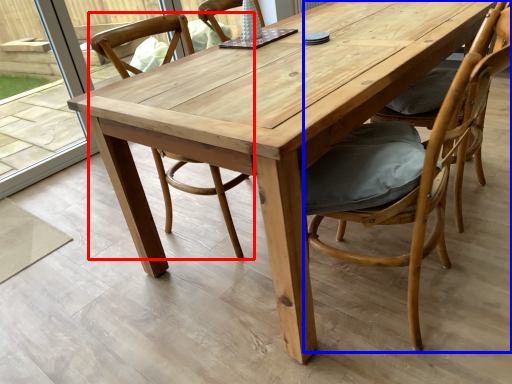
Question: Among these objects, which one is nearest to the camera, chair (highlighted by a red box) or chair (highlighted by a blue box)?

Choices:
 (A) chair
 (B) chair

Answer: (B)